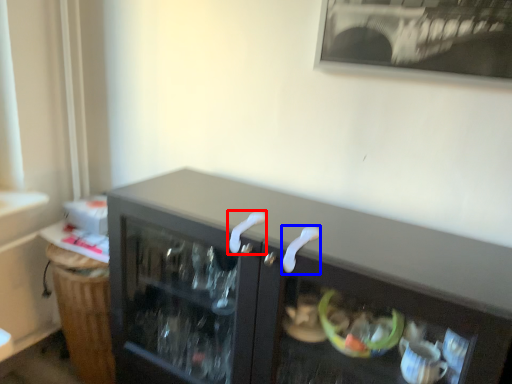
Question: Among these objects, which one is nearest to the camera, door handle (highlighted by a red box) or door handle (highlighted by a blue box)?

Choices:
 (A) door handle
 (B) door handle

Answer: (B)